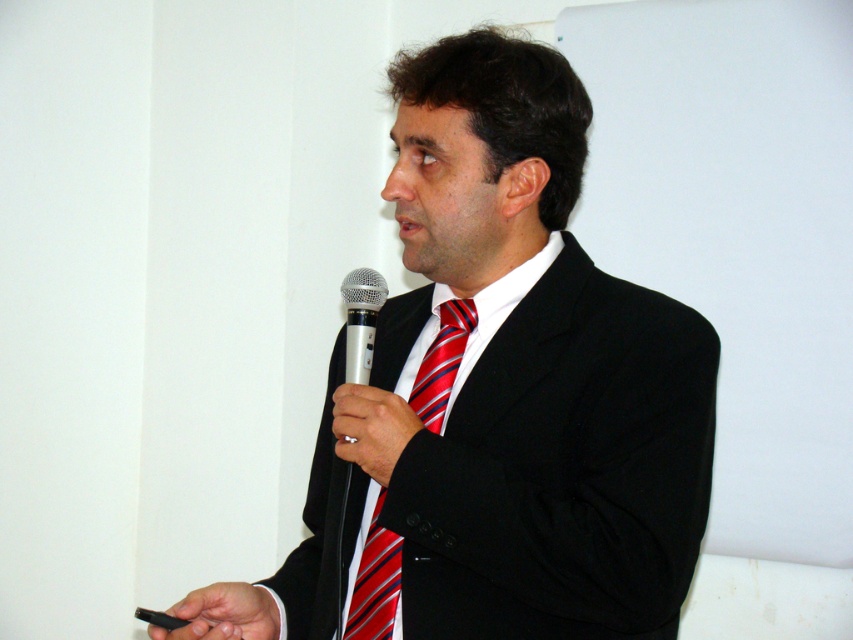
You are an assistant organizing a presentation. You notice the red striped tie at center and the black matte usb drive at lower left in the image. Which object is closer to the speaker?

The red striped tie at center is closer to the speaker because the black matte usb drive at lower left is behind it, indicating the tie is in front and thus nearer.

Looking at this image, you are organizing a charity event and need to ensure that all donated items fit into a storage box. The box has a maximum capacity for items no larger than the red striped tie at center. Can the black matte suit at center be stored in this box?

The black matte suit at center is bigger than the red striped tie at center, so it cannot be stored in the box designed for items no larger than the red striped tie at center.

You are an assistant who needs to describe the position of the objects in the scene. Where is the red striped tie at center relative to the smooth black hand at center?

The red striped tie at center is to the right of the smooth black hand at center.